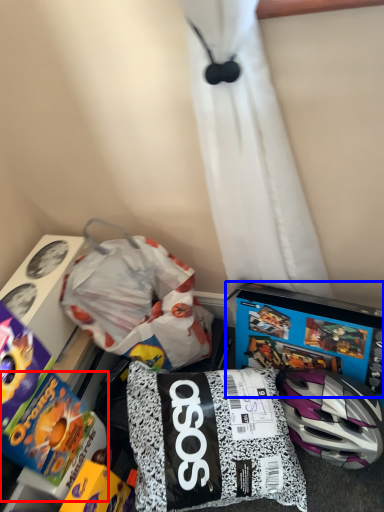
Question: Which of the following is the closest to the observer, toy (highlighted by a red box) or video game (highlighted by a blue box)?

Choices:
 (A) toy
 (B) video game

Answer: (A)